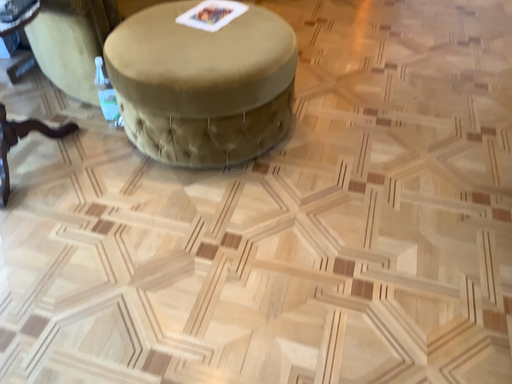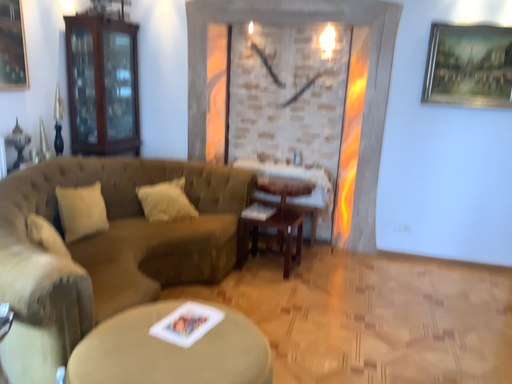
Question: How did the camera likely rotate when shooting the video?

Choices:
 (A) rotated downward
 (B) rotated upward

Answer: (B)